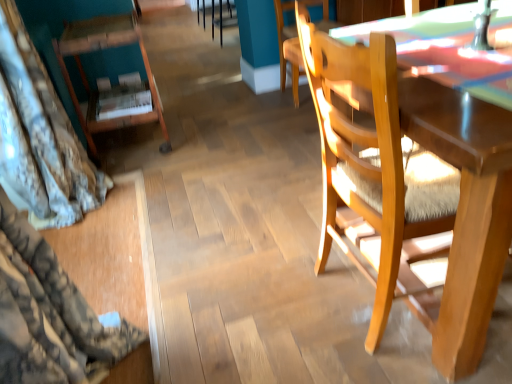
Question: Considering the relative sizes of wooden chair at right, the 3th chair positioned from the left, and wooden chair at center, which ranks as the 2th chair in right-to-left order, in the image provided, is wooden chair at right, the 3th chair positioned from the left, wider than wooden chair at center, which ranks as the 2th chair in right-to-left order,?

Choices:
 (A) no
 (B) yes

Answer: (B)

Question: Considering the relative positions of wooden chair at right, the 3th chair positioned from the left, and wooden chair at center, the third chair from the front, in the image provided, is wooden chair at right, the 3th chair positioned from the left, to the right of wooden chair at center, the third chair from the front, from the viewer's perspective?

Choices:
 (A) yes
 (B) no

Answer: (A)

Question: Is the depth of wooden chair at right, which appears as the 3th chair when viewed from the back, greater than that of wooden chair at center, the third chair from the front?

Choices:
 (A) no
 (B) yes

Answer: (A)

Question: Considering the relative sizes of wooden chair at right, the 3th chair positioned from the left, and wooden chair at center, which is the 1th chair in back-to-front order, in the image provided, is wooden chair at right, the 3th chair positioned from the left, thinner than wooden chair at center, which is the 1th chair in back-to-front order,?

Choices:
 (A) no
 (B) yes

Answer: (A)

Question: Can you confirm if wooden chair at right, arranged as the first chair when viewed from the front, is positioned to the left of wooden chair at center, the 2th chair positioned from the left?

Choices:
 (A) yes
 (B) no

Answer: (B)

Question: Would you say wooden chair at center, which is the 1th chair in back-to-front order, is part of wooden chair at right, the 1th chair in the right-to-left sequence,'s contents?

Choices:
 (A) no
 (B) yes

Answer: (A)

Question: Is wooden bookshelf at left, arranged as the 2th chair when viewed from the front, at the right side of wooden chair at right, the 1th chair in the right-to-left sequence?

Choices:
 (A) no
 (B) yes

Answer: (A)

Question: From the image's perspective, would you say wooden bookshelf at left, placed as the 1th chair when sorted from left to right, is shown under wooden chair at right, the 3th chair positioned from the left?

Choices:
 (A) no
 (B) yes

Answer: (A)

Question: From a real-world perspective, is wooden bookshelf at left, the 2th chair in the back-to-front sequence, physically below wooden chair at right, the 1th chair in the right-to-left sequence?

Choices:
 (A) no
 (B) yes

Answer: (B)

Question: Is wooden bookshelf at left, the 2th chair in the back-to-front sequence, outside of wooden chair at right, which appears as the 3th chair when viewed from the back?

Choices:
 (A) no
 (B) yes

Answer: (B)

Question: Are wooden bookshelf at left, arranged as the 2th chair when viewed from the front, and wooden chair at right, arranged as the first chair when viewed from the front, making contact?

Choices:
 (A) no
 (B) yes

Answer: (A)

Question: Does wooden bookshelf at left, which is counted as the 3th chair, starting from the right, turn towards wooden chair at right, the 1th chair in the right-to-left sequence?

Choices:
 (A) yes
 (B) no

Answer: (B)

Question: Can you confirm if wooden bookshelf at left, placed as the 1th chair when sorted from left to right, is wider than wooden chair at center, the 2th chair positioned from the left?

Choices:
 (A) no
 (B) yes

Answer: (A)